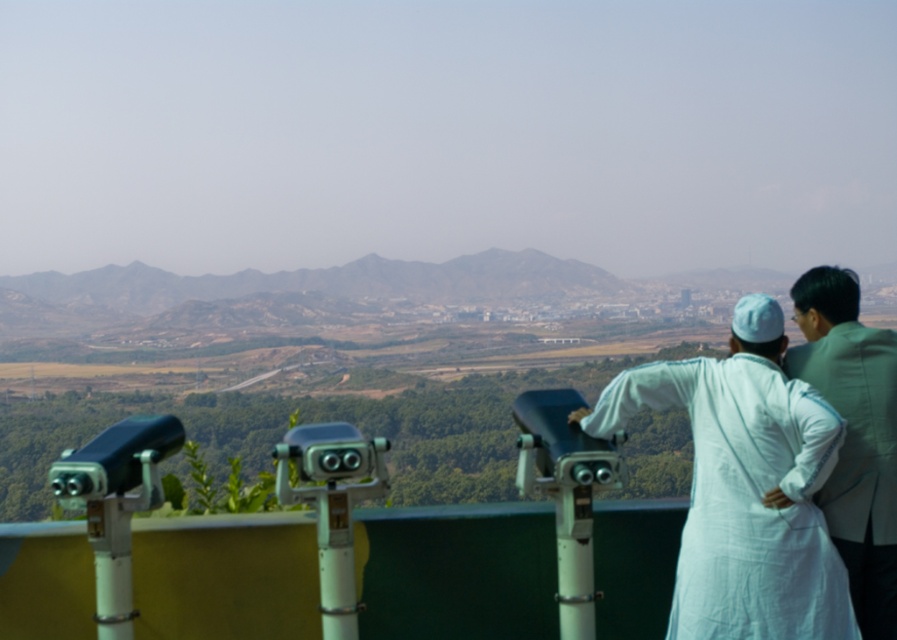
Can you confirm if white cotton robe at center is wider than white cotton robe at upper right?

Indeed, white cotton robe at center has a greater width compared to white cotton robe at upper right.

Can you confirm if white cotton robe at center is positioned to the left of white cotton robe at upper right?

Indeed, white cotton robe at center is positioned on the left side of white cotton robe at upper right.

Does point (706, 436) come closer to viewer compared to point (881, 432)?

Yes, it is in front of point (881, 432).

The image size is (897, 640). Find the location of `white cotton robe at center`. white cotton robe at center is located at coordinates (745, 497).